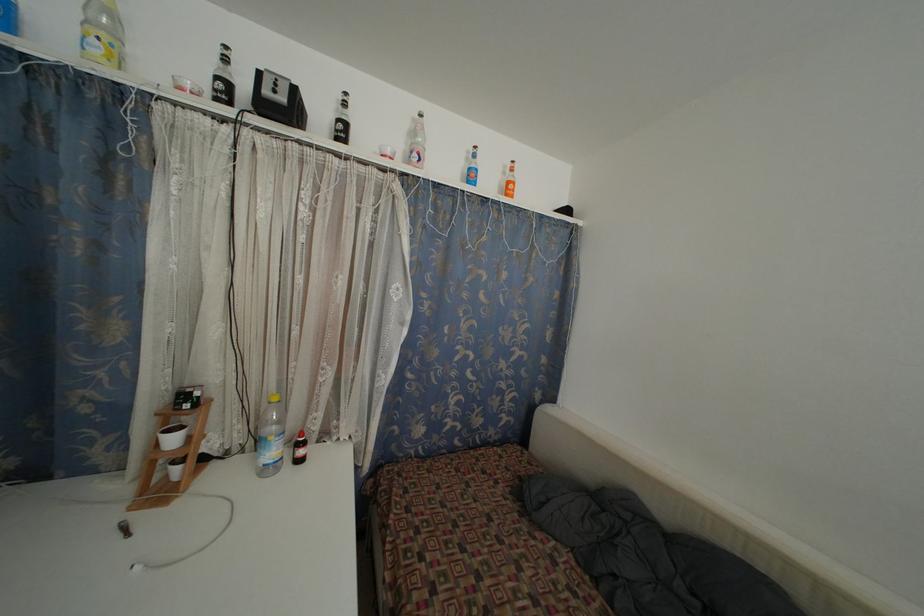
At what (x,y) coordinates should I click in order to perform the action: click on blue glass bottle. Please return your answer as a coordinate pair (x, y). This screenshot has width=924, height=616. Looking at the image, I should click on (471, 167).